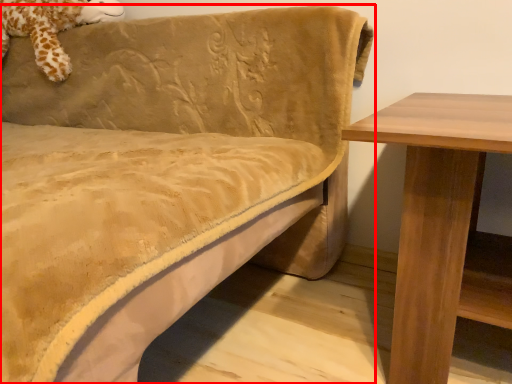
Question: Where is studio couch (annotated by the red box) located in relation to animal in the image?

Choices:
 (A) right
 (B) left

Answer: (A)